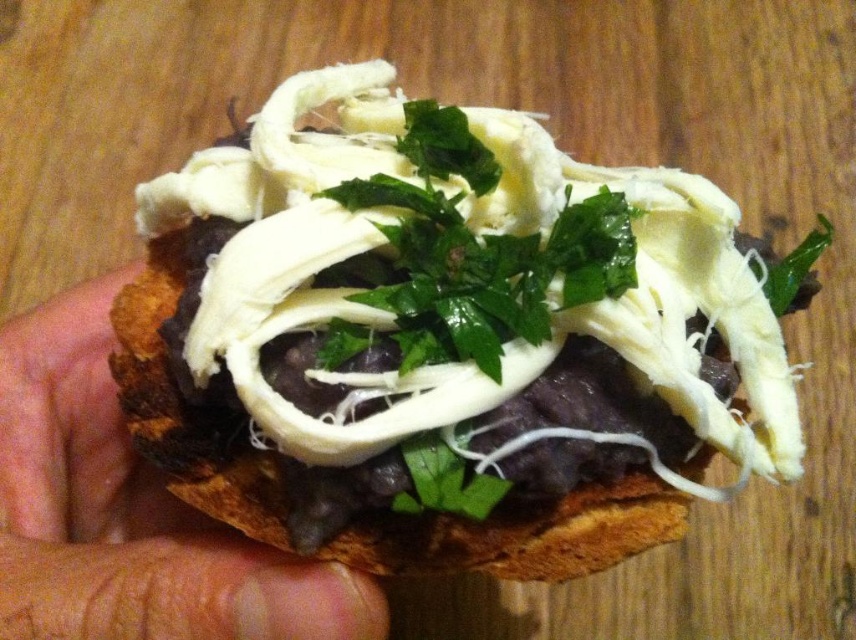
Is white creamy cheese at center wider than brown skin at center?

Indeed, white creamy cheese at center has a greater width compared to brown skin at center.

Between point (655, 467) and point (27, 467), which one is positioned behind?

The point (27, 467) is more distant.

From the picture: Who is more forward, [476,394] or [36,604]?

Point [476,394]

I want to click on white creamy cheese at center, so click(x=444, y=337).